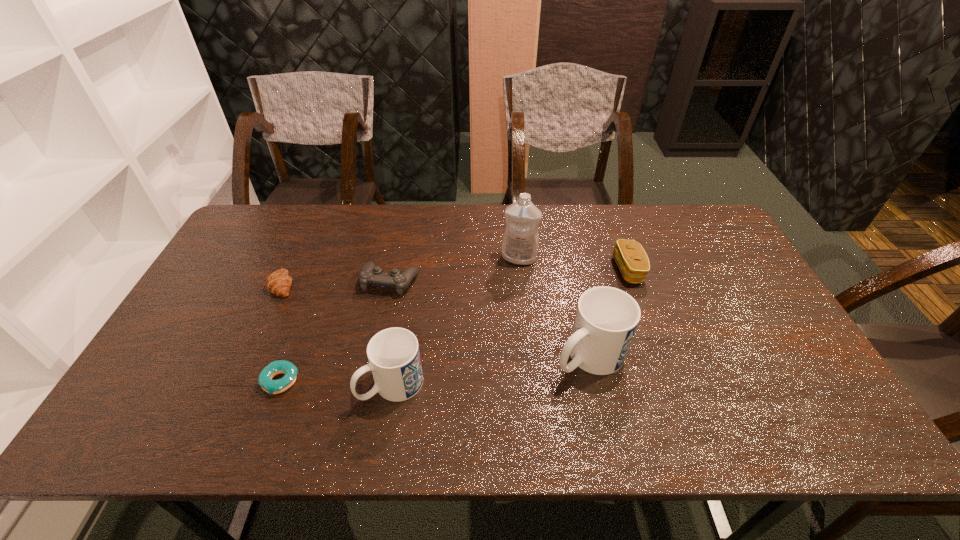
Where is `vacant point that satisfies the following two spatial constraints: 1. on the front side of the control; 2. on the left side of the right mug`? Image resolution: width=960 pixels, height=540 pixels. vacant point that satisfies the following two spatial constraints: 1. on the front side of the control; 2. on the left side of the right mug is located at coordinates (374, 356).